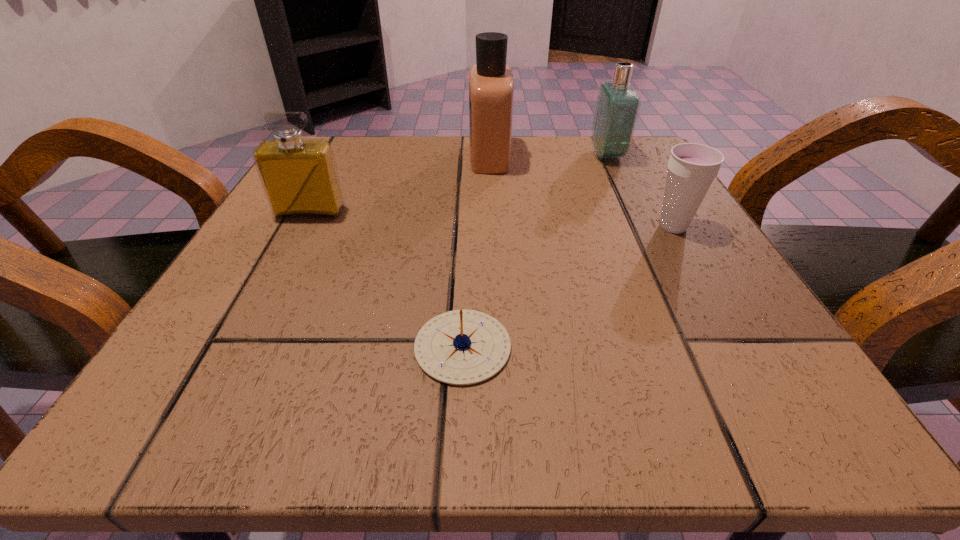
Locate an element on the screen. The image size is (960, 540). unoccupied position between the rightmost perfume and the cup is located at coordinates (640, 191).

Locate an element on the screen. This screenshot has width=960, height=540. vacant point located between the rightmost perfume and the tallest object is located at coordinates (548, 155).

Locate an element on the screen. vacant region between the rightmost perfume and the second shortest object is located at coordinates (640, 191).

The width and height of the screenshot is (960, 540). Find the location of `empty location between the tallest object and the cup`. empty location between the tallest object and the cup is located at coordinates click(582, 191).

The image size is (960, 540). Find the location of `free point between the rightmost perfume and the nearest perfume`. free point between the rightmost perfume and the nearest perfume is located at coordinates (459, 183).

In order to click on empty space between the leftmost object and the fourth tallest object in this screenshot , I will do `click(492, 219)`.

In order to click on free space between the tallest perfume and the cup in this screenshot , I will do `click(582, 191)`.

Where is `free point between the second shortest object and the shortest object`? The image size is (960, 540). free point between the second shortest object and the shortest object is located at coordinates (568, 287).

This screenshot has height=540, width=960. Identify the location of vacant space that is in between the rightmost perfume and the compass. (535, 251).

Select which object appears as the fourth closest to the tallest perfume. Please provide its 2D coordinates. Your answer should be formatted as a tuple, i.e. [(x, y)], where the tuple contains the x and y coordinates of a point satisfying the conditions above.

[(461, 347)]